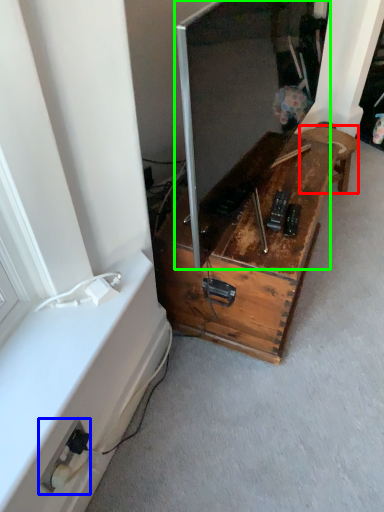
Question: Which object is the closest to the furniture (highlighted by a red box)? Choose among these: electric outlet (highlighted by a blue box) or window screen (highlighted by a green box).

Choices:
 (A) electric outlet
 (B) window screen

Answer: (B)